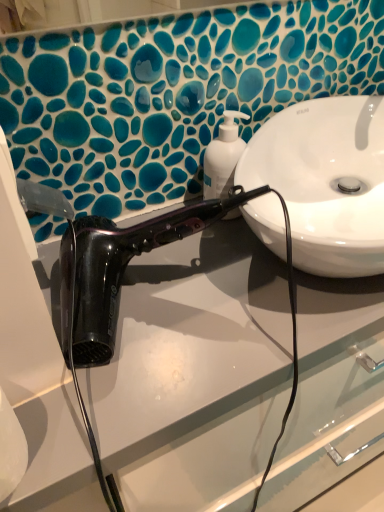
Question: Is white glossy soap dispenser at center in front of or behind shiny black hair dryer at center in the image?

Choices:
 (A) front
 (B) behind

Answer: (B)

Question: Would you say white glossy soap dispenser at center is to the left or to the right of shiny black hair dryer at center in the picture?

Choices:
 (A) right
 (B) left

Answer: (A)

Question: From a real-world perspective, is white glossy soap dispenser at center physically located above or below shiny black hair dryer at center?

Choices:
 (A) above
 (B) below

Answer: (A)

Question: From the image's perspective, relative to white glossy soap dispenser at center, is shiny black hair dryer at center above or below?

Choices:
 (A) below
 (B) above

Answer: (A)

Question: Is shiny black hair dryer at center in front of or behind white glossy soap dispenser at center in the image?

Choices:
 (A) behind
 (B) front

Answer: (B)

Question: Does point (77, 244) appear closer or farther from the camera than point (221, 189)?

Choices:
 (A) farther
 (B) closer

Answer: (B)

Question: Is shiny black hair dryer at center bigger or smaller than white glossy soap dispenser at center?

Choices:
 (A) big
 (B) small

Answer: (A)